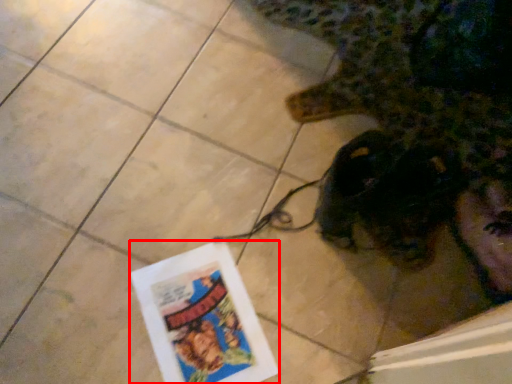
Question: Where is flyer (annotated by the red box) located in relation to animal in the image?

Choices:
 (A) right
 (B) left

Answer: (B)